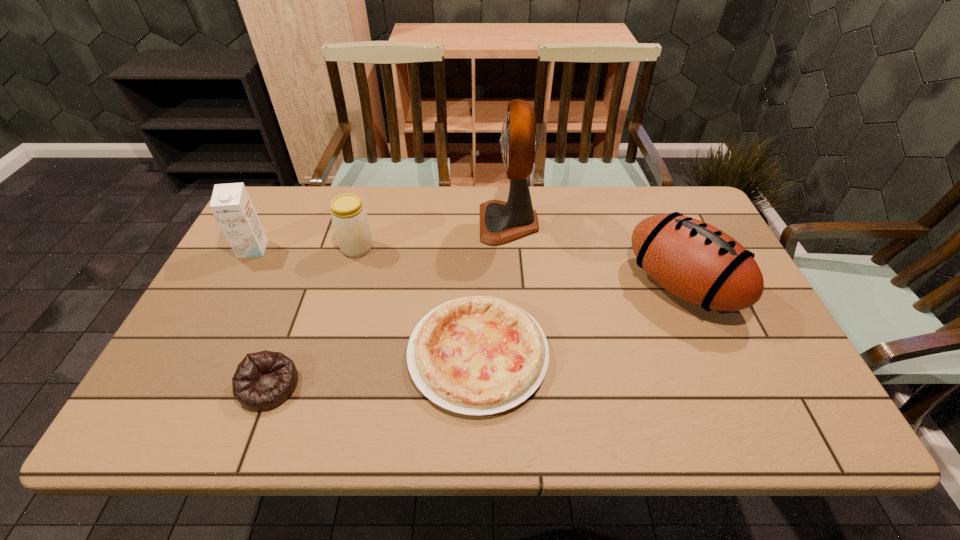
Identify the location of free region located on the left of the football (American). (612, 286).

The width and height of the screenshot is (960, 540). What are the coordinates of `free space located 0.240m on the left of the jar` in the screenshot? It's located at (259, 248).

Identify the location of vacant space located on the back of the beanbag. (286, 340).

At what (x,y) coordinates should I click in order to perform the action: click on vacant space located on the left of the pizza. Please return your answer as a coordinate pair (x, y). The width and height of the screenshot is (960, 540). Looking at the image, I should click on (340, 354).

I want to click on object present at the far edge, so click(x=501, y=222).

Image resolution: width=960 pixels, height=540 pixels. I want to click on beanbag that is at the near edge, so click(263, 380).

Find the location of a particular element. pizza situated at the near edge is located at coordinates click(478, 355).

The image size is (960, 540). What are the coordinates of `object located in the left edge section of the desktop` in the screenshot? It's located at (231, 205).

Identify the location of object located at the right edge. (695, 261).

Locate an element on the screen. vacant space at the far edge is located at coordinates (551, 196).